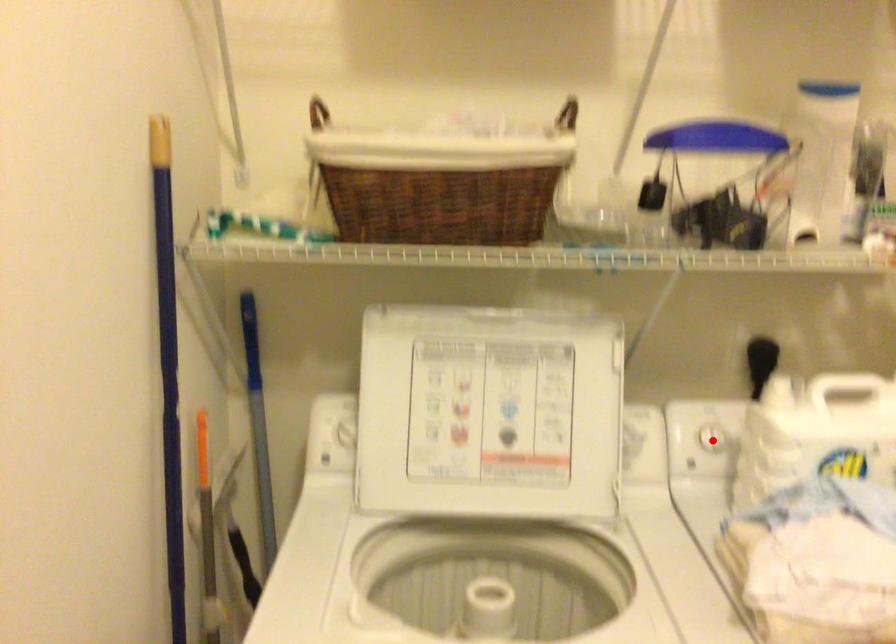
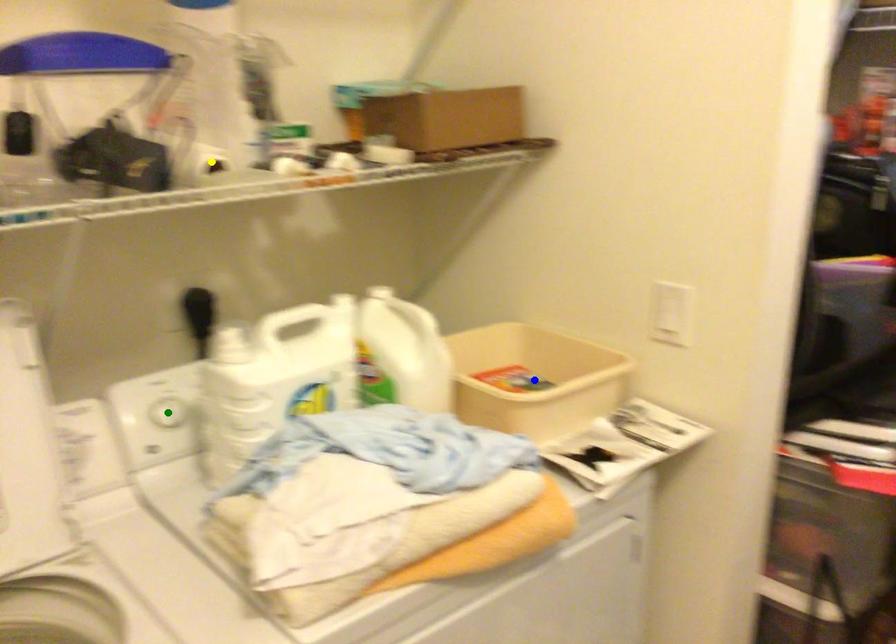
Question: I am providing you with two images of the same scene from different viewpoints. A red point is marked on the first image. You are given multiple points on the second image. Which point in image 2 represents the same 3d spot as the red point in image 1?

Choices:
 (A) yellow point
 (B) blue point
 (C) green point

Answer: (C)